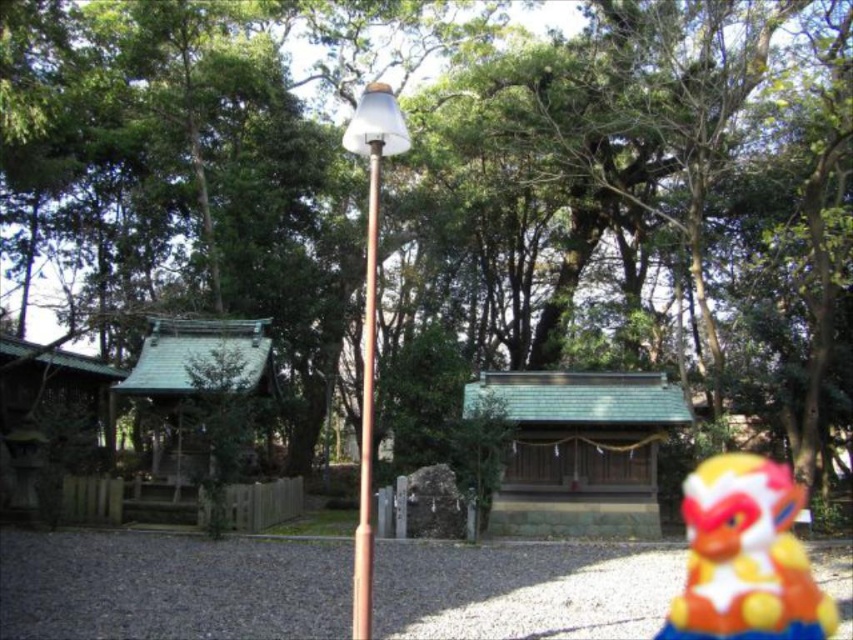
Question: Is plastic toy monkey at lower right to the right of metallic brown pole at center from the viewer's perspective?

Choices:
 (A) no
 (B) yes

Answer: (B)

Question: Based on their relative distances, which object is farther from the plastic toy monkey at lower right?

Choices:
 (A) metallic brown pole at center
 (B) gray gravel at lower center
 (C) copper metallic pole at center

Answer: (C)

Question: Which of the following is the closest to the observer?

Choices:
 (A) metallic brown pole at center
 (B) plastic toy monkey at lower right
 (C) gray gravel at lower center

Answer: (A)

Question: Which point is closer to the camera taking this photo?

Choices:
 (A) coord(747,636)
 (B) coord(241,605)

Answer: (A)

Question: Does plastic toy monkey at lower right appear over metallic brown pole at center?

Choices:
 (A) yes
 (B) no

Answer: (B)

Question: Does gray gravel at lower center have a smaller size compared to copper metallic pole at center?

Choices:
 (A) yes
 (B) no

Answer: (A)